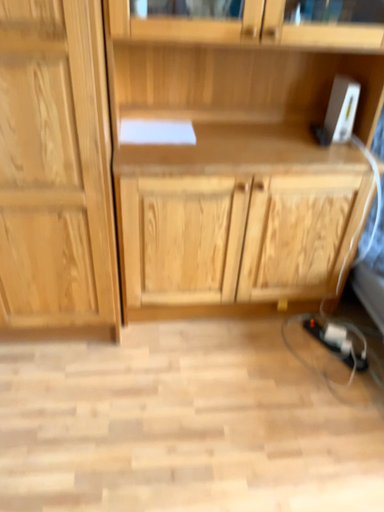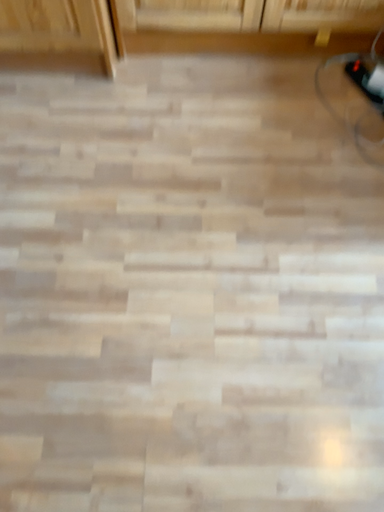
Question: How did the camera likely rotate when shooting the video?

Choices:
 (A) rotated left
 (B) rotated right

Answer: (A)